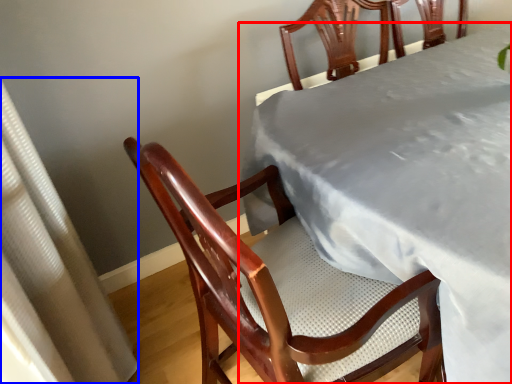
Question: Which object appears farthest to the camera in this image, table (highlighted by a red box) or curtain (highlighted by a blue box)?

Choices:
 (A) table
 (B) curtain

Answer: (A)